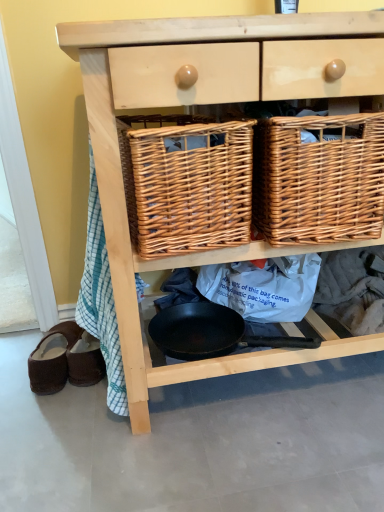
This screenshot has width=384, height=512. Find the location of `brown suede sandals at lower left, which appears as the 2th footwear when viewed from the left`. brown suede sandals at lower left, which appears as the 2th footwear when viewed from the left is located at coordinates (85, 361).

Measure the distance between point (x=276, y=36) and camera.

27.91 inches.

Identify the location of woven brown picnic basket at center, the second picnic basket positioned from the right. This screenshot has width=384, height=512. (186, 183).

Locate an element on the screen. This screenshot has width=384, height=512. brown suede sandals at lower left, which appears as the 2th footwear when viewed from the left is located at coordinates (85, 361).

Is natural wood chest of drawers at center aimed at brown suede slippers at lower left, which is the second footwear from right to left?

No.

Can brown suede slippers at lower left, the 1th footwear from the left, be found inside natural wood chest of drawers at center?

Definitely not — brown suede slippers at lower left, the 1th footwear from the left, is not inside natural wood chest of drawers at center.

From a real-world perspective, between natural wood chest of drawers at center and brown suede slippers at lower left, the 1th footwear from the left, who is vertically lower?

brown suede slippers at lower left, the 1th footwear from the left.

Would you say natural wood chest of drawers at center is a long distance from brown suede slippers at lower left, the 1th footwear from the left?

natural wood chest of drawers at center is actually quite close to brown suede slippers at lower left, the 1th footwear from the left.

Does woven brown picnic basket at center, the second picnic basket positioned from the right, have a greater height compared to brown suede slippers at lower left, which is the second footwear from right to left?

Correct, woven brown picnic basket at center, the second picnic basket positioned from the right, is much taller as brown suede slippers at lower left, which is the second footwear from right to left.

Is woven brown picnic basket at center, the second picnic basket positioned from the right, beside brown suede slippers at lower left, which is the second footwear from right to left?

No, woven brown picnic basket at center, the second picnic basket positioned from the right, is not in contact with brown suede slippers at lower left, which is the second footwear from right to left.

Relative to brown suede slippers at lower left, which is the second footwear from right to left, is woven brown picnic basket at center, the second picnic basket positioned from the right, in front or behind?

woven brown picnic basket at center, the second picnic basket positioned from the right, is positioned closer to the viewer than brown suede slippers at lower left, which is the second footwear from right to left.

Does point (251, 193) come farther from viewer compared to point (37, 384)?

No, (251, 193) is closer to viewer.

Can you confirm if brown suede sandals at lower left, which appears as the 2th footwear when viewed from the left, is positioned to the left of woven brown picnic basket at center, placed as the 1th picnic basket when sorted from right to left?

Yes.

From the image's perspective, is brown suede sandals at lower left, which is the 1th footwear in right-to-left order, above or below woven brown picnic basket at center, which is counted as the second picnic basket, starting from the left?

Clearly, from the image's perspective, brown suede sandals at lower left, which is the 1th footwear in right-to-left order, is below woven brown picnic basket at center, which is counted as the second picnic basket, starting from the left.

Could you tell me if brown suede sandals at lower left, which appears as the 2th footwear when viewed from the left, is facing woven brown picnic basket at center, which is counted as the second picnic basket, starting from the left?

No, brown suede sandals at lower left, which appears as the 2th footwear when viewed from the left, is not aimed at woven brown picnic basket at center, which is counted as the second picnic basket, starting from the left.

From the picture: What's the angular difference between brown suede sandals at lower left, which is the 1th footwear in right-to-left order, and woven brown picnic basket at center, which is counted as the second picnic basket, starting from the left,'s facing directions?

The angle between the facing direction of brown suede sandals at lower left, which is the 1th footwear in right-to-left order, and the facing direction of woven brown picnic basket at center, which is counted as the second picnic basket, starting from the left, is 3.89 degrees.

Considering the relative positions of black non-stick frying pan at center and woven brown picnic basket at center, which is counted as the second picnic basket, starting from the left, in the image provided, is black non-stick frying pan at center to the left of woven brown picnic basket at center, which is counted as the second picnic basket, starting from the left, from the viewer's perspective?

Correct, you'll find black non-stick frying pan at center to the left of woven brown picnic basket at center, which is counted as the second picnic basket, starting from the left.

Is black non-stick frying pan at center bigger or smaller than woven brown picnic basket at center, placed as the 1th picnic basket when sorted from right to left?

black non-stick frying pan at center is smaller than woven brown picnic basket at center, placed as the 1th picnic basket when sorted from right to left.

How many degrees apart are the facing directions of brown suede slippers at lower left, which is the second footwear from right to left, and black non-stick frying pan at center?

There is a 15.7-degree angle between the facing directions of brown suede slippers at lower left, which is the second footwear from right to left, and black non-stick frying pan at center.

Identify the location of the 2nd footwear to the left when counting from the black non-stick frying pan at center. The width and height of the screenshot is (384, 512). (65, 359).

Between brown suede slippers at lower left, which is the second footwear from right to left, and black non-stick frying pan at center, which one appears on the right side from the viewer's perspective?

From the viewer's perspective, black non-stick frying pan at center appears more on the right side.

Looking at this image, is brown suede slippers at lower left, the 1th footwear from the left, oriented away from black non-stick frying pan at center?

No, black non-stick frying pan at center is not at the back of brown suede slippers at lower left, the 1th footwear from the left.

Can you confirm if brown suede sandals at lower left, which appears as the 2th footwear when viewed from the left, is bigger than woven brown picnic basket at center, the 1th picnic basket from the left?

Actually, brown suede sandals at lower left, which appears as the 2th footwear when viewed from the left, might be smaller than woven brown picnic basket at center, the 1th picnic basket from the left.

In the scene shown: Can you confirm if brown suede sandals at lower left, which appears as the 2th footwear when viewed from the left, is shorter than woven brown picnic basket at center, the 1th picnic basket from the left?

Yes.

From the image's perspective, relative to woven brown picnic basket at center, the 1th picnic basket from the left, is brown suede sandals at lower left, which appears as the 2th footwear when viewed from the left, above or below?

brown suede sandals at lower left, which appears as the 2th footwear when viewed from the left, is situated lower than woven brown picnic basket at center, the 1th picnic basket from the left, in the image.

This screenshot has width=384, height=512. In order to click on picnic basket that is the 1st object to the right of the brown suede sandals at lower left, which appears as the 2th footwear when viewed from the left, starting at the anchor in this screenshot , I will do `click(186, 183)`.

Which is more to the left, brown suede slippers at lower left, which is the second footwear from right to left, or woven brown picnic basket at center, which is counted as the second picnic basket, starting from the left?

From the viewer's perspective, brown suede slippers at lower left, which is the second footwear from right to left, appears more on the left side.

Considering the relative positions of brown suede slippers at lower left, which is the second footwear from right to left, and woven brown picnic basket at center, which is counted as the second picnic basket, starting from the left, in the image provided, is brown suede slippers at lower left, which is the second footwear from right to left, in front of woven brown picnic basket at center, which is counted as the second picnic basket, starting from the left,?

No.

Would you say brown suede slippers at lower left, which is the second footwear from right to left, is outside woven brown picnic basket at center, placed as the 1th picnic basket when sorted from right to left?

Yes.

Which is closer, (86, 354) or (338, 176)?

The point (338, 176) is more forward.

In the image, there is a brown suede slippers at lower left, the 1th footwear from the left. In order to click on the chest of drawers above it (from the image's perspective) in this screenshot , I will do `click(176, 105)`.

From a real-world perspective, count 2nd footwears downward from the woven brown picnic basket at center, the second picnic basket positioned from the right, and point to it. Please provide its 2D coordinates.

[(65, 359)]

Consider the image. Which object lies further to the anchor point brown suede sandals at lower left, which appears as the 2th footwear when viewed from the left, woven brown picnic basket at center, placed as the 1th picnic basket when sorted from right to left, or black non-stick frying pan at center?

woven brown picnic basket at center, placed as the 1th picnic basket when sorted from right to left, lies further to brown suede sandals at lower left, which appears as the 2th footwear when viewed from the left, than the other object.

Which object lies further to the anchor point brown suede slippers at lower left, the 1th footwear from the left, brown suede sandals at lower left, which is the 1th footwear in right-to-left order, or natural wood chest of drawers at center?

Based on the image, natural wood chest of drawers at center appears to be further to brown suede slippers at lower left, the 1th footwear from the left.

Estimate the real-world distances between objects in this image. Which object is closer to woven brown picnic basket at center, the second picnic basket positioned from the right, black non-stick frying pan at center or natural wood chest of drawers at center?

natural wood chest of drawers at center lies closer to woven brown picnic basket at center, the second picnic basket positioned from the right, than the other object.

Estimate the real-world distances between objects in this image. Which object is closer to brown suede sandals at lower left, which is the 1th footwear in right-to-left order, brown suede slippers at lower left, which is the second footwear from right to left, or black non-stick frying pan at center?

brown suede slippers at lower left, which is the second footwear from right to left, is closer to brown suede sandals at lower left, which is the 1th footwear in right-to-left order.

From the image, which object appears to be nearer to woven brown picnic basket at center, the second picnic basket positioned from the right, woven brown picnic basket at center, which is counted as the second picnic basket, starting from the left, or brown suede slippers at lower left, the 1th footwear from the left?

woven brown picnic basket at center, which is counted as the second picnic basket, starting from the left, lies closer to woven brown picnic basket at center, the second picnic basket positioned from the right, than the other object.

Looking at the image, which one is located closer to natural wood chest of drawers at center, brown suede slippers at lower left, the 1th footwear from the left, or black non-stick frying pan at center?

black non-stick frying pan at center lies closer to natural wood chest of drawers at center than the other object.

Estimate the real-world distances between objects in this image. Which object is closer to black non-stick frying pan at center, woven brown picnic basket at center, the second picnic basket positioned from the right, or brown suede sandals at lower left, which appears as the 2th footwear when viewed from the left?

brown suede sandals at lower left, which appears as the 2th footwear when viewed from the left.

Estimate the real-world distances between objects in this image. Which object is further from black non-stick frying pan at center, woven brown picnic basket at center, placed as the 1th picnic basket when sorted from right to left, or woven brown picnic basket at center, the second picnic basket positioned from the right?

woven brown picnic basket at center, placed as the 1th picnic basket when sorted from right to left.

Where is `picnic basket between brown suede sandals at lower left, which appears as the 2th footwear when viewed from the left, and woven brown picnic basket at center, placed as the 1th picnic basket when sorted from right to left`? Image resolution: width=384 pixels, height=512 pixels. picnic basket between brown suede sandals at lower left, which appears as the 2th footwear when viewed from the left, and woven brown picnic basket at center, placed as the 1th picnic basket when sorted from right to left is located at coordinates (186, 183).

This screenshot has width=384, height=512. I want to click on frying pan situated between brown suede slippers at lower left, the 1th footwear from the left, and natural wood chest of drawers at center from left to right, so pyautogui.click(x=210, y=332).

Locate an element on the screen. frying pan between brown suede sandals at lower left, which is the 1th footwear in right-to-left order, and natural wood chest of drawers at center is located at coordinates (210, 332).

I want to click on the chest of drawers between woven brown picnic basket at center, the second picnic basket positioned from the right, and black non-stick frying pan at center vertically, so click(x=176, y=105).